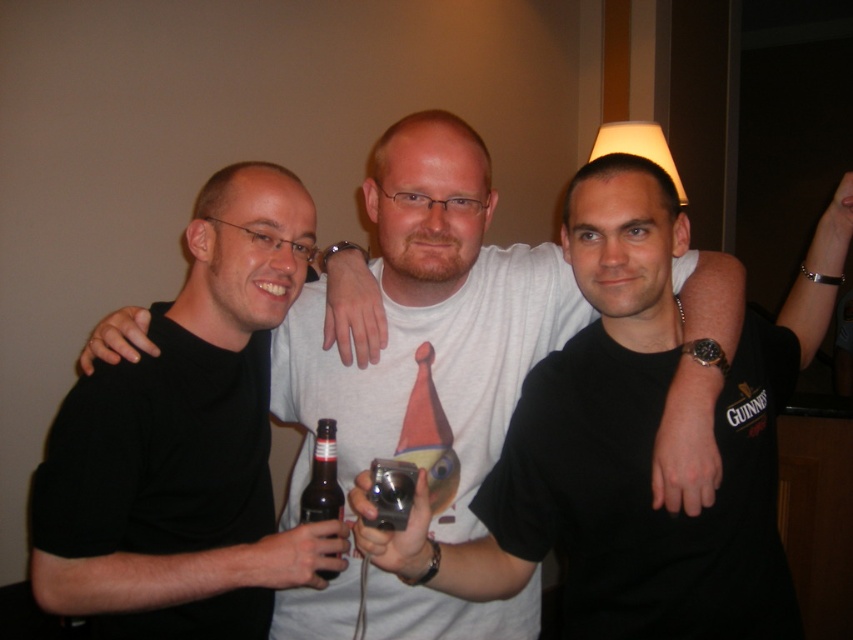
Is black matte shirt at center below metallic silver camera at center?

No, black matte shirt at center is not below metallic silver camera at center.

The width and height of the screenshot is (853, 640). What do you see at coordinates (432, 314) in the screenshot?
I see `black matte shirt at center` at bounding box center [432, 314].

The width and height of the screenshot is (853, 640). What are the coordinates of `black matte shirt at center` in the screenshot? It's located at (432, 314).

In order to click on black matte shirt at center in this screenshot , I will do `click(432, 314)`.

Who is higher up, black matte shirt at left or black matte shirt at center?

black matte shirt at left is above.

This screenshot has height=640, width=853. What do you see at coordinates (186, 442) in the screenshot? I see `black matte shirt at left` at bounding box center [186, 442].

I want to click on black matte shirt at left, so click(186, 442).

Who is positioned more to the left, white cotton t-shirt at center or brown glass bottle at center?

brown glass bottle at center

Can you confirm if white cotton t-shirt at center is positioned to the right of brown glass bottle at center?

Indeed, white cotton t-shirt at center is positioned on the right side of brown glass bottle at center.

Between point (653, 332) and point (341, 502), which one is positioned behind?

Positioned behind is point (653, 332).

At what (x,y) coordinates should I click in order to perform the action: click on white cotton t-shirt at center. Please return your answer as a coordinate pair (x, y). Image resolution: width=853 pixels, height=640 pixels. Looking at the image, I should click on (572, 417).